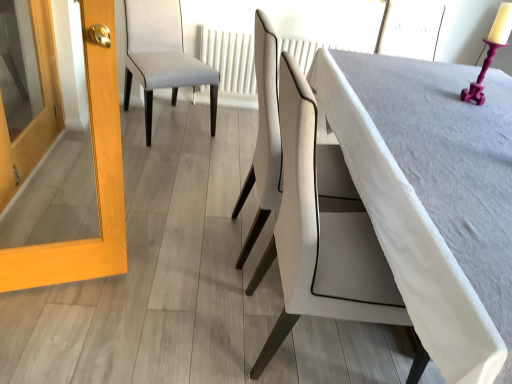
Locate an element on the screen. Image resolution: width=512 pixels, height=384 pixels. vacant area in front of light wood frame at left is located at coordinates (50, 332).